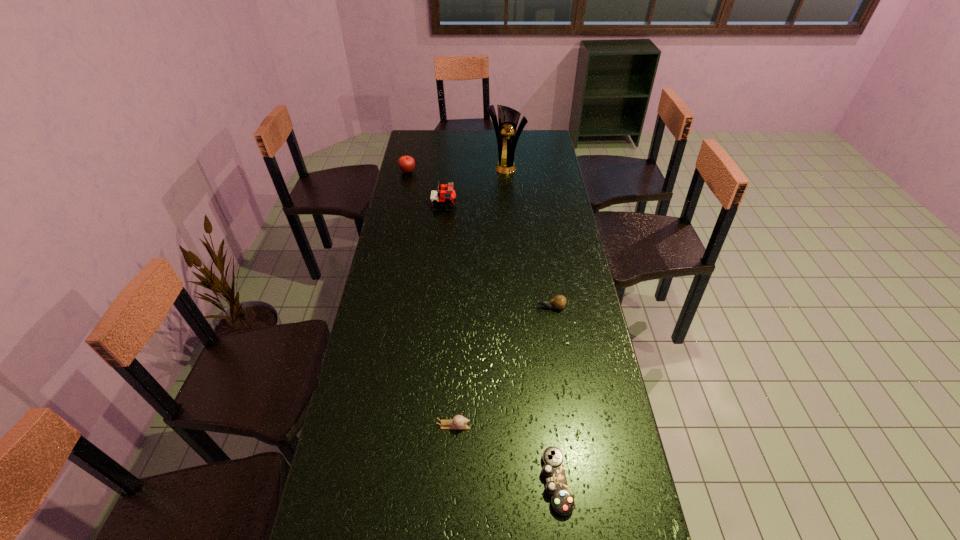
The width and height of the screenshot is (960, 540). Find the location of `free space between the farther escargot and the fifth shortest object`. free space between the farther escargot and the fifth shortest object is located at coordinates (497, 256).

Image resolution: width=960 pixels, height=540 pixels. Identify the location of empty location between the shortest object and the tallest object. (531, 323).

Image resolution: width=960 pixels, height=540 pixels. I want to click on free space that is in between the second nearest object and the fourth tallest object, so click(x=502, y=367).

Find the location of a particular element. free space between the control and the third farthest object is located at coordinates (500, 343).

Find the location of `free spot between the nearest object and the award`. free spot between the nearest object and the award is located at coordinates (531, 323).

Locate an element on the screen. This screenshot has width=960, height=540. free space between the leftmost object and the tallest object is located at coordinates (457, 168).

Choose which object is the nearest neighbor to the second nearest object. Please provide its 2D coordinates. Your answer should be formatted as a tuple, i.e. [(x, y)], where the tuple contains the x and y coordinates of a point satisfying the conditions above.

[(562, 502)]

Locate which object ranks fourth in proximity to the fifth farthest object. Please provide its 2D coordinates. Your answer should be formatted as a tuple, i.e. [(x, y)], where the tuple contains the x and y coordinates of a point satisfying the conditions above.

[(406, 163)]

Identify the location of vacant area in the image that satisfies the following two spatial constraints: 1. on the front-facing side of the Lego; 2. on the back side of the shortest object. (418, 482).

This screenshot has width=960, height=540. I want to click on vacant area in the image that satisfies the following two spatial constraints: 1. at the front of the tallest object, where the globe is visible; 2. on the shell of the shorter escargot, so point(525,426).